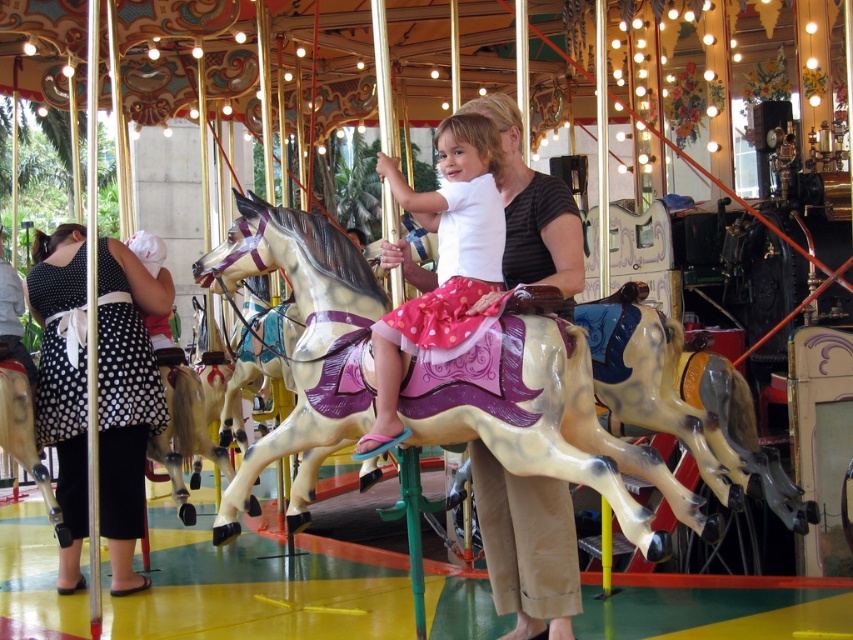
Question: Which point appears closest to the camera in this image?

Choices:
 (A) (144, 381)
 (B) (496, 157)

Answer: (B)

Question: Based on their relative distances, which object is nearer to the painted wood horse at center?

Choices:
 (A) matte black shirt at center
 (B) matte white shirt at center

Answer: (B)

Question: Is black dotted dress at left further to the viewer compared to matte black shirt at center?

Choices:
 (A) no
 (B) yes

Answer: (B)

Question: Which point is closer to the camera taking this photo?

Choices:
 (A) (643, 540)
 (B) (520, 620)

Answer: (A)

Question: Can you confirm if painted wood horse at center is positioned below matte white shirt at center?

Choices:
 (A) yes
 (B) no

Answer: (A)

Question: Can you confirm if painted wood horse at center is smaller than matte black shirt at center?

Choices:
 (A) no
 (B) yes

Answer: (A)